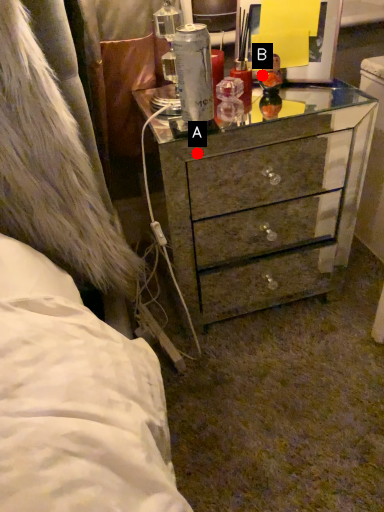
Question: Two points are circled on the image, labeled by A and B beside each circle. Among these points, which one is nearest to the camera?

Choices:
 (A) A is closer
 (B) B is closer

Answer: (B)